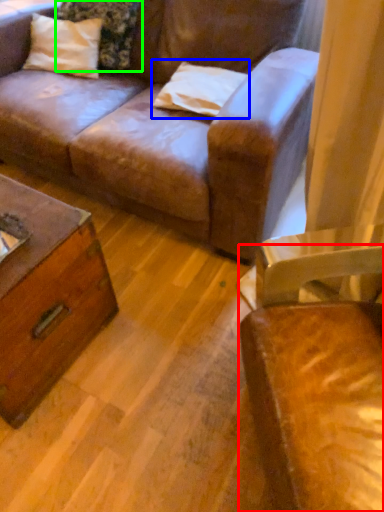
Question: Which is nearer to the chair (highlighted by a red box)? pillow (highlighted by a blue box) or pillow (highlighted by a green box).

Choices:
 (A) pillow
 (B) pillow

Answer: (A)